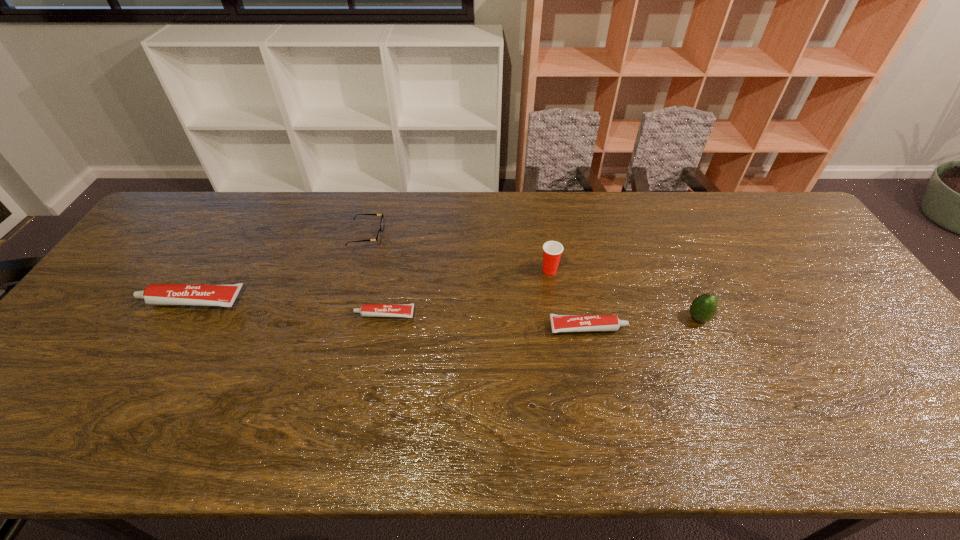
At what (x,y) coordinates should I click in order to perform the action: click on unoccupied area between the Dixie cup and the spectacles. Please return your answer as a coordinate pair (x, y). Looking at the image, I should click on pos(458,253).

This screenshot has width=960, height=540. What are the coordinates of `free space between the tallest toothpaste and the second toothpaste from right to left` in the screenshot? It's located at (288, 308).

You are a GUI agent. You are given a task and a screenshot of the screen. Output one action in this format:
    pyautogui.click(x=<x>, y=<y>)
    Task: Click on the unoccupied position between the rightmost object and the leftmost toothpaste
    The height and width of the screenshot is (540, 960).
    Given the screenshot: What is the action you would take?
    pyautogui.click(x=444, y=310)

Locate an element on the screen. the closest object to the shortest object is located at coordinates (378, 238).

Choose which object is the nearest neighbor to the rightmost object. Please provide its 2D coordinates. Your answer should be formatted as a tuple, i.e. [(x, y)], where the tuple contains the x and y coordinates of a point satisfying the conditions above.

[(560, 323)]

Select which toothpaste is the closest to the leftmost toothpaste. Please provide its 2D coordinates. Your answer should be formatted as a tuple, i.e. [(x, y)], where the tuple contains the x and y coordinates of a point satisfying the conditions above.

[(366, 310)]

Choose which toothpaste is the second nearest neighbor to the tallest toothpaste. Please provide its 2D coordinates. Your answer should be formatted as a tuple, i.e. [(x, y)], where the tuple contains the x and y coordinates of a point satisfying the conditions above.

[(560, 323)]

Where is `vacant point that satisfies the following two spatial constraints: 1. on the front-facing side of the farthest object; 2. on the right side of the Dixie cup`? The image size is (960, 540). vacant point that satisfies the following two spatial constraints: 1. on the front-facing side of the farthest object; 2. on the right side of the Dixie cup is located at coordinates pos(357,270).

The image size is (960, 540). I want to click on free space that satisfies the following two spatial constraints: 1. on the front-facing side of the rightmost object; 2. on the right side of the farthest object, so click(x=344, y=318).

Locate an element on the screen. free space that satisfies the following two spatial constraints: 1. at the nozzle of the avocado; 2. on the right side of the leftmost object is located at coordinates (180, 318).